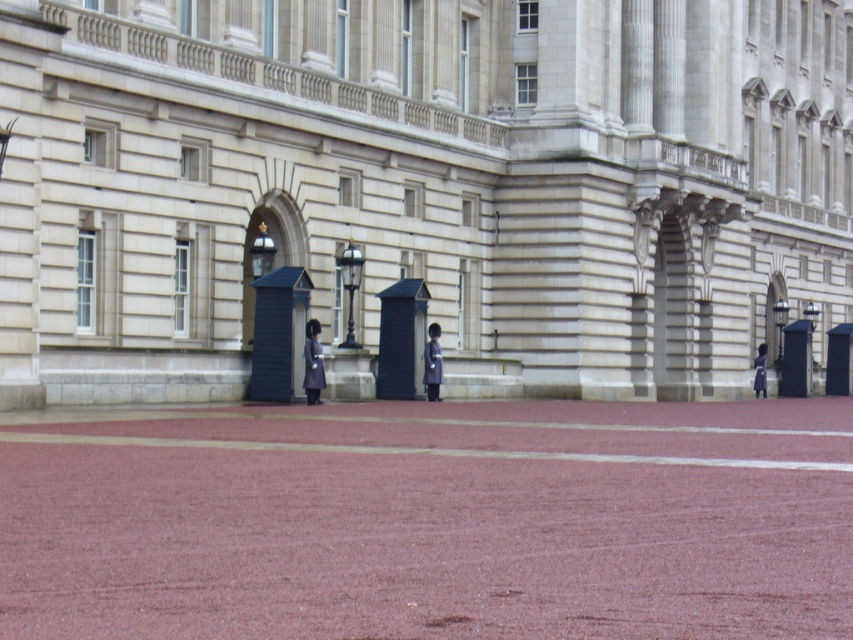
Question: Which point appears farthest from the camera in this image?

Choices:
 (A) (310, 353)
 (B) (428, 328)

Answer: (B)

Question: Does shiny dark blue uniform at center have a greater width compared to dark blue uniform at center?

Choices:
 (A) yes
 (B) no

Answer: (A)

Question: Can you confirm if smooth stone building at center is positioned below shiny black uniform at center?

Choices:
 (A) no
 (B) yes

Answer: (A)

Question: Among these objects, which one is nearest to the camera?

Choices:
 (A) dark blue uniform at center
 (B) smooth stone building at center

Answer: (B)

Question: Which point is farther from the camera taking this photo?

Choices:
 (A) pyautogui.click(x=305, y=368)
 (B) pyautogui.click(x=753, y=380)
 (C) pyautogui.click(x=404, y=179)

Answer: (B)

Question: Observing the image, what is the correct spatial positioning of shiny dark blue uniform at center in reference to dark blue uniform at center?

Choices:
 (A) left
 (B) right

Answer: (A)